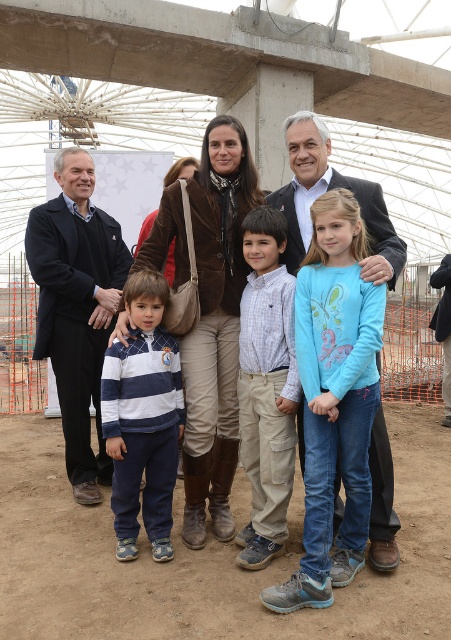
Can you confirm if brown dirt field at lower center is positioned to the left of blue cotton shirt at center?

Yes, brown dirt field at lower center is to the left of blue cotton shirt at center.

Between point (362, 589) and point (390, 522), which one is positioned in front?

Positioned in front is point (362, 589).

Locate an element on the screen. This screenshot has height=640, width=451. brown dirt field at lower center is located at coordinates (208, 556).

Is brown dirt field at lower center bigger than dark blue suit at center?

Yes.

Measure the distance between point (50, 556) and camera.

A distance of 3.48 meters exists between point (50, 556) and camera.

Image resolution: width=451 pixels, height=640 pixels. In order to click on brown dirt field at lower center in this screenshot , I will do `click(208, 556)`.

How distant is blue cotton shirt at center from dark blue suit at center?

A distance of 1.09 meters exists between blue cotton shirt at center and dark blue suit at center.

Is blue cotton shirt at center wider than dark blue suit at center?

Indeed, blue cotton shirt at center has a greater width compared to dark blue suit at center.

This screenshot has width=451, height=640. Describe the element at coordinates (327, 189) in the screenshot. I see `blue cotton shirt at center` at that location.

Locate an element on the screen. blue cotton shirt at center is located at coordinates (327, 189).